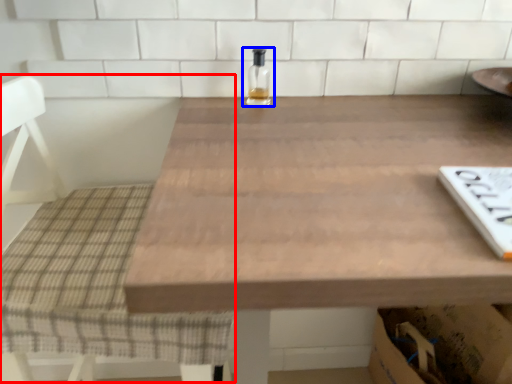
Question: Which point is further to the camera, chair (highlighted by a red box) or bottle (highlighted by a blue box)?

Choices:
 (A) chair
 (B) bottle

Answer: (B)